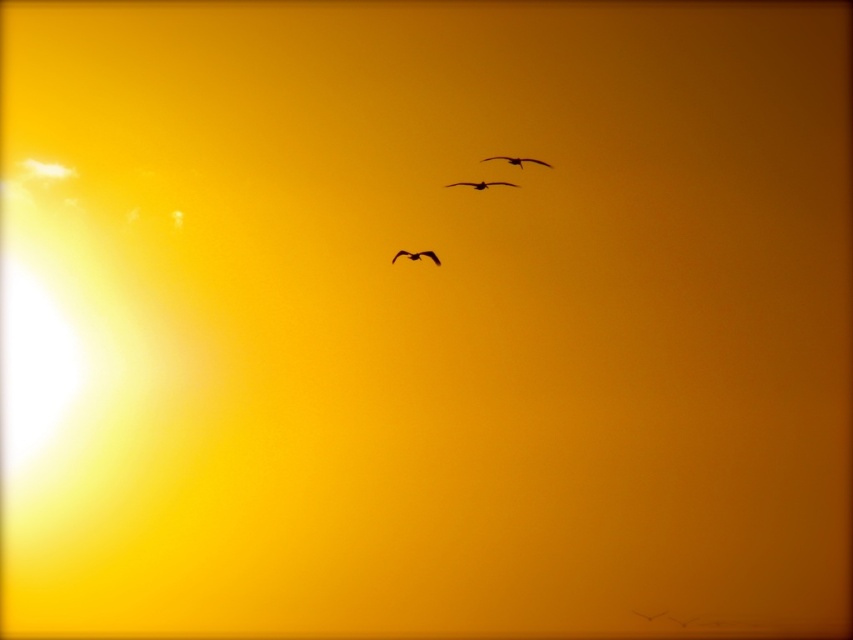
Which is behind, point (469, 186) or point (415, 253)?

The point (469, 186) is more distant.

Can you confirm if dark brown feathered bird at center is positioned below black matte bird at center?

Incorrect, dark brown feathered bird at center is not positioned below black matte bird at center.

In order to click on dark brown feathered bird at center in this screenshot , I will do `click(480, 184)`.

Is dark brown feathered bird at center thinner than black matte bird at upper center?

Incorrect, dark brown feathered bird at center's width is not less than black matte bird at upper center's.

Is point (496, 184) positioned behind point (492, 157)?

Yes.

You are a GUI agent. You are given a task and a screenshot of the screen. Output one action in this format:
    pyautogui.click(x=<x>, y=<y>)
    Task: Click on the dark brown feathered bird at center
    This screenshot has width=853, height=640.
    Given the screenshot: What is the action you would take?
    pyautogui.click(x=480, y=184)

Who is lower down, black matte bird at upper center or black matte bird at center?

black matte bird at center is lower down.

Which is behind, point (521, 164) or point (399, 252)?

Positioned behind is point (399, 252).

What do you see at coordinates (517, 161) in the screenshot? I see `black matte bird at upper center` at bounding box center [517, 161].

Locate an element on the screen. The width and height of the screenshot is (853, 640). black matte bird at upper center is located at coordinates (517, 161).